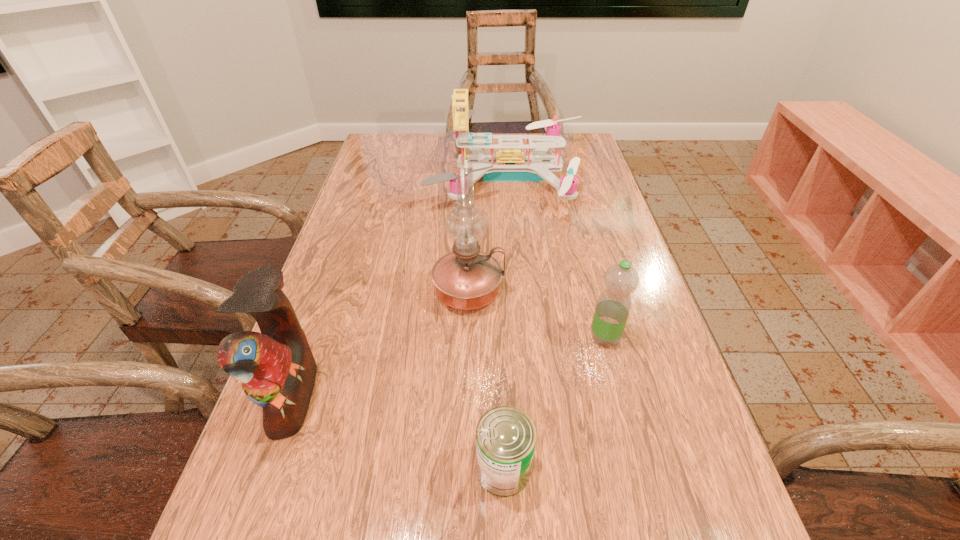
I want to click on free space between the oil lamp and the fourth tallest object, so click(x=537, y=314).

At what (x,y) coordinates should I click in order to perform the action: click on object that ranks as the second closest to the second shortest object. Please return your answer as a coordinate pair (x, y). Looking at the image, I should click on (506, 436).

Find the location of a particular element. Image resolution: width=960 pixels, height=540 pixels. object that is the nearest to the shortest object is located at coordinates (613, 306).

This screenshot has height=540, width=960. Identify the location of blank space that satisfies the following two spatial constraints: 1. on the front-facing side of the second shortest object; 2. on the left side of the drone. (524, 337).

You are a GUI agent. You are given a task and a screenshot of the screen. Output one action in this format:
    pyautogui.click(x=<x>, y=<y>)
    Task: Click on the free region that satisfies the following two spatial constraints: 1. on the front side of the tallest object; 2. on the right side of the second shortest object
    This screenshot has width=960, height=540.
    Given the screenshot: What is the action you would take?
    pyautogui.click(x=467, y=337)

Where is `vacant space that satisfies the following two spatial constraints: 1. at the face of the parrot; 2. on the right side of the can`? vacant space that satisfies the following two spatial constraints: 1. at the face of the parrot; 2. on the right side of the can is located at coordinates tap(267, 469).

Where is `free space that satisfies the following two spatial constraints: 1. on the back side of the second shortest object; 2. on the right side of the can`? This screenshot has width=960, height=540. free space that satisfies the following two spatial constraints: 1. on the back side of the second shortest object; 2. on the right side of the can is located at coordinates (498, 337).

The width and height of the screenshot is (960, 540). Find the location of `vacant region that satisfies the following two spatial constraints: 1. on the front-facing side of the farthest object; 2. on the front side of the can`. vacant region that satisfies the following two spatial constraints: 1. on the front-facing side of the farthest object; 2. on the front side of the can is located at coordinates (537, 469).

At what (x,y) coordinates should I click in order to perform the action: click on vacant region that satisfies the following two spatial constraints: 1. on the front-facing side of the drone; 2. on the back side of the third nearest object. Please return your answer as a coordinate pair (x, y). This screenshot has width=960, height=540. Looking at the image, I should click on (524, 337).